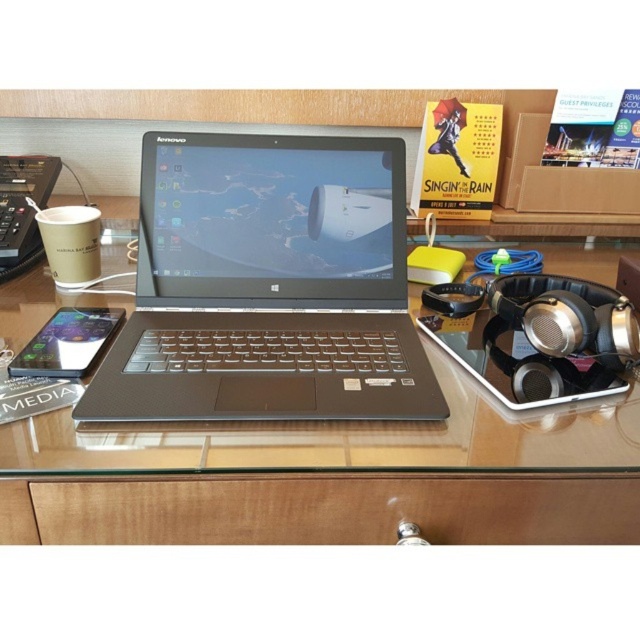
Question: Which point is farther to the camera?

Choices:
 (A) satin black phone at lower left
 (B) matte black laptop at center
 (C) glossy glass desk at center
 (D) brown paper cup at left

Answer: (D)

Question: Does matte black laptop at center lie in front of satin black phone at lower left?

Choices:
 (A) no
 (B) yes

Answer: (B)

Question: Is glossy glass desk at center further to camera compared to brown paper cup at left?

Choices:
 (A) yes
 (B) no

Answer: (B)

Question: Among these objects, which one is nearest to the camera?

Choices:
 (A) matte black laptop at center
 (B) wooden drawer at lower center

Answer: (B)

Question: Which point is closer to the camera taking this photo?

Choices:
 (A) (28, 342)
 (B) (340, 257)
 (C) (156, 474)
 (D) (250, 518)

Answer: (C)

Question: Does satin black phone at lower left have a lesser width compared to brown paper cup at left?

Choices:
 (A) yes
 (B) no

Answer: (A)